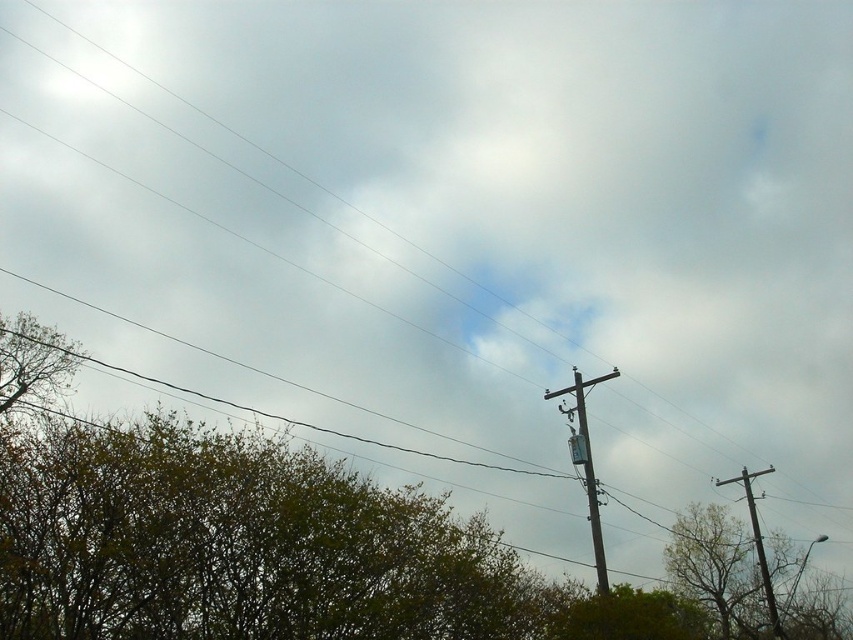
You are standing in the middle of the scene and want to walk towards the green leafy tree at lower right. Based on its position, in which direction should you head?

The green leafy tree at lower right is located at point 0.884 on the x axis and 0.839 on the y axis. Since you are in the middle, you should head towards the bottom right direction to reach it.

You are standing at the center of the image. Which direction should you walk to reach the green leafy tree at lower left?

Answer: You should walk towards the lower left direction to reach the green leafy tree at lower left since it is located at point (236, 545).